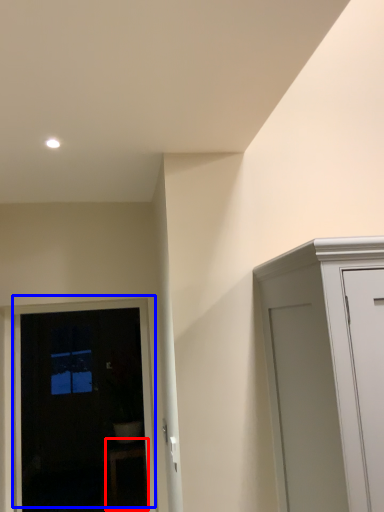
Question: Among these objects, which one is nearest to the camera, furniture (highlighted by a red box) or door (highlighted by a blue box)?

Choices:
 (A) furniture
 (B) door

Answer: (B)